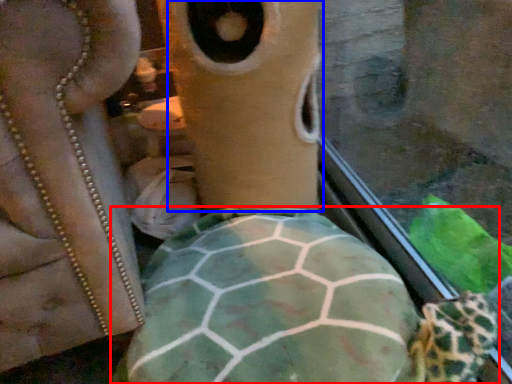
Question: Which object is further to the camera taking this photo, tortoise (highlighted by a red box) or face (highlighted by a blue box)?

Choices:
 (A) tortoise
 (B) face

Answer: (B)